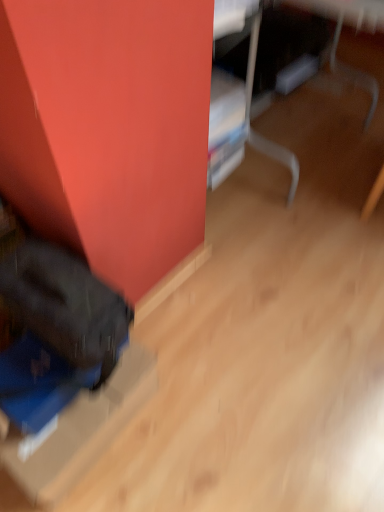
The width and height of the screenshot is (384, 512). What do you see at coordinates (83, 429) in the screenshot?
I see `blue cardboard box at lower left` at bounding box center [83, 429].

This screenshot has width=384, height=512. In order to click on blue cardboard box at lower left in this screenshot , I will do `click(83, 429)`.

Looking at this image, what is the approximate height of blue cardboard box at lower left?

The height of blue cardboard box at lower left is 9.05 inches.

The image size is (384, 512). I want to click on matte black bag at lower left, so click(123, 128).

Describe the element at coordinates (123, 128) in the screenshot. I see `matte black bag at lower left` at that location.

This screenshot has width=384, height=512. Find the location of `blue cardboard box at lower left`. blue cardboard box at lower left is located at coordinates (83, 429).

Between blue cardboard box at lower left and matte black bag at lower left, which one appears on the right side from the viewer's perspective?

matte black bag at lower left is more to the right.

Is blue cardboard box at lower left positioned in front of matte black bag at lower left?

No, it is behind matte black bag at lower left.

Does point (39, 457) lie behind point (165, 137)?

Yes, it is behind point (165, 137).

From the image's perspective, is blue cardboard box at lower left on matte black bag at lower left?

No.

From a real-world perspective, is blue cardboard box at lower left positioned above or below matte black bag at lower left?

In terms of real-world spatial position, blue cardboard box at lower left is above matte black bag at lower left.

In terms of width, does blue cardboard box at lower left look wider or thinner when compared to matte black bag at lower left?

In the image, blue cardboard box at lower left appears to be more narrow than matte black bag at lower left.

Does blue cardboard box at lower left have a lesser height compared to matte black bag at lower left?

Incorrect, the height of blue cardboard box at lower left does not fall short of that of matte black bag at lower left.

Looking at the image, does blue cardboard box at lower left seem bigger or smaller compared to matte black bag at lower left?

Considering their sizes, blue cardboard box at lower left takes up less space than matte black bag at lower left.

Which is correct: blue cardboard box at lower left is inside matte black bag at lower left, or outside of it?

blue cardboard box at lower left is outside matte black bag at lower left.

Would you consider blue cardboard box at lower left to be distant from matte black bag at lower left?

No, blue cardboard box at lower left is not far from matte black bag at lower left.

Could you tell me if blue cardboard box at lower left is turned towards matte black bag at lower left?

No, blue cardboard box at lower left does not turn towards matte black bag at lower left.

How different are the orientations of blue cardboard box at lower left and matte black bag at lower left in degrees?

178 degrees.

In the image, there is a matte black bag at lower left. Identify the location of cardboard box below it (from the image's perspective). (83, 429).

Does matte black bag at lower left appear on the right side of blue cardboard box at lower left?

Indeed, matte black bag at lower left is positioned on the right side of blue cardboard box at lower left.

Which is behind, matte black bag at lower left or blue cardboard box at lower left?

blue cardboard box at lower left is more distant.

Does point (153, 66) come closer to viewer compared to point (32, 453)?

Yes, it is.

From the image's perspective, is matte black bag at lower left above blue cardboard box at lower left?

Yes, from the image's perspective, matte black bag at lower left is on top of blue cardboard box at lower left.

From a real-world perspective, does matte black bag at lower left sit lower than blue cardboard box at lower left?

Yes, from a real-world perspective, matte black bag at lower left is below blue cardboard box at lower left.

Between matte black bag at lower left and blue cardboard box at lower left, which one has larger width?

matte black bag at lower left is wider.

Considering the relative sizes of matte black bag at lower left and blue cardboard box at lower left in the image provided, is matte black bag at lower left shorter than blue cardboard box at lower left?

Indeed, matte black bag at lower left has a lesser height compared to blue cardboard box at lower left.

Does matte black bag at lower left have a smaller size compared to blue cardboard box at lower left?

Actually, matte black bag at lower left might be larger than blue cardboard box at lower left.

Would you say matte black bag at lower left contains blue cardboard box at lower left?

No, blue cardboard box at lower left is not a part of matte black bag at lower left.

Is matte black bag at lower left beside blue cardboard box at lower left?

matte black bag at lower left is not next to blue cardboard box at lower left, and they're not touching.

Could you tell me if matte black bag at lower left is facing blue cardboard box at lower left?

No, matte black bag at lower left is not oriented towards blue cardboard box at lower left.

Can you tell me how much matte black bag at lower left and blue cardboard box at lower left differ in facing direction?

The facing directions of matte black bag at lower left and blue cardboard box at lower left are 178 degrees apart.

What are the coordinates of `furniture on the right of the blue cardboard box at lower left` in the screenshot? It's located at (123, 128).

At what (x,y) coordinates should I click in order to perform the action: click on furniture that appears below the blue cardboard box at lower left (from a real-world perspective). Please return your answer as a coordinate pair (x, y). Looking at the image, I should click on (123, 128).

What are the coordinates of `cardboard box above the matte black bag at lower left (from a real-world perspective)` in the screenshot? It's located at (83, 429).